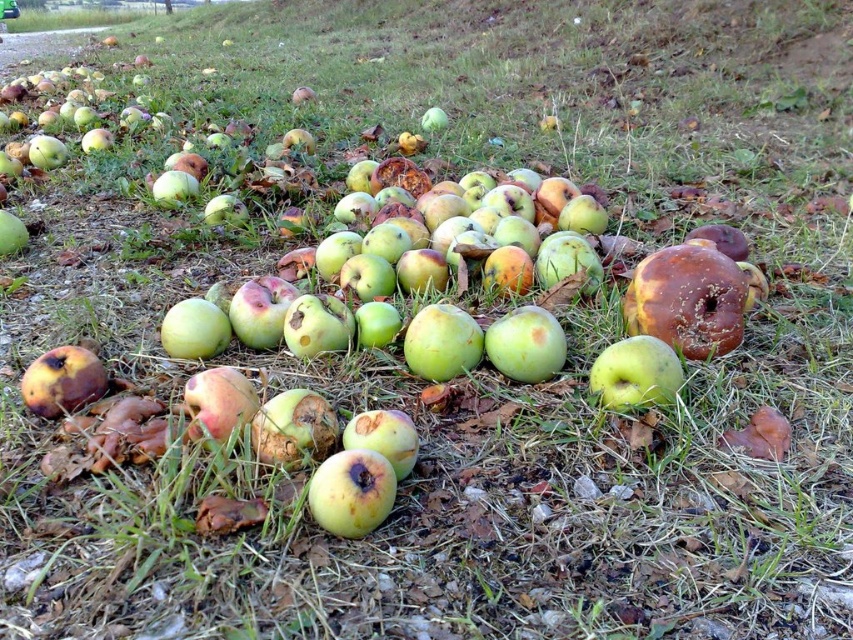
Question: Is green matte apple at center wider than rotten green apple at lower left?

Choices:
 (A) yes
 (B) no

Answer: (A)

Question: Which of these objects is positioned closest to the rotten green apple at lower left?

Choices:
 (A) green matte apple at center
 (B) greenish-yellow matte apple at center

Answer: (B)

Question: Which of the following is the closest to the observer?

Choices:
 (A) green matte apple at center
 (B) greenish-yellow matte apple at center
 (C) rotten green apple at lower left

Answer: (B)

Question: Is greenish-yellow matte apple at center wider than green matte apple at center?

Choices:
 (A) no
 (B) yes

Answer: (A)

Question: Observing the image, what is the correct spatial positioning of green matte apple at center in reference to rotten green apple at lower left?

Choices:
 (A) above
 (B) below

Answer: (A)

Question: Which point is closer to the camera?

Choices:
 (A) (605, 365)
 (B) (387, 484)
 (C) (68, 349)

Answer: (B)